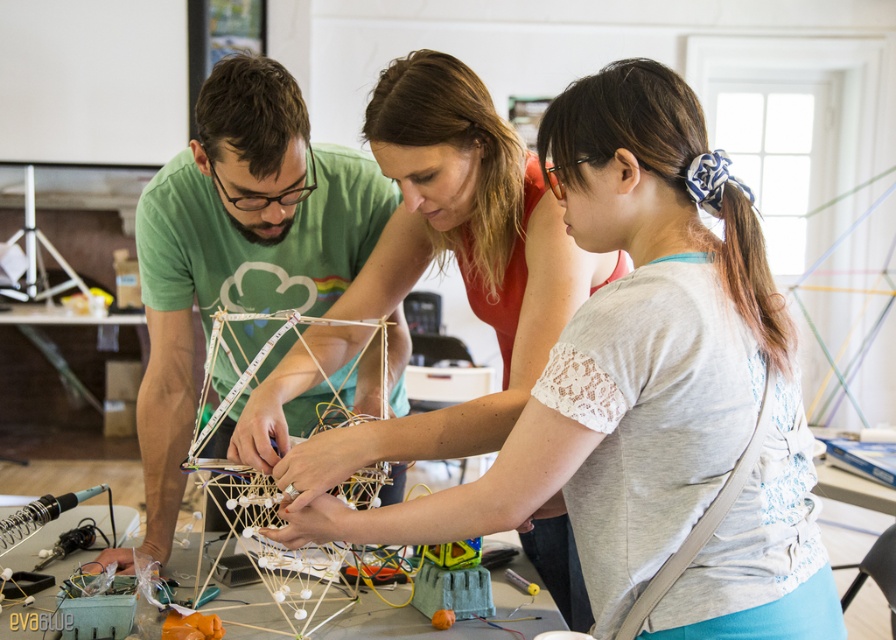
Question: Does white lace shirt at center appear on the right side of green matte shirt at center?

Choices:
 (A) yes
 (B) no

Answer: (A)

Question: Is white lace shirt at center below green matte shirt at center?

Choices:
 (A) yes
 (B) no

Answer: (A)

Question: Can you confirm if white lace shirt at center is positioned to the left of green matte shirt at center?

Choices:
 (A) no
 (B) yes

Answer: (A)

Question: Among these objects, which one is nearest to the camera?

Choices:
 (A) white lace shirt at center
 (B) green matte shirt at center

Answer: (A)